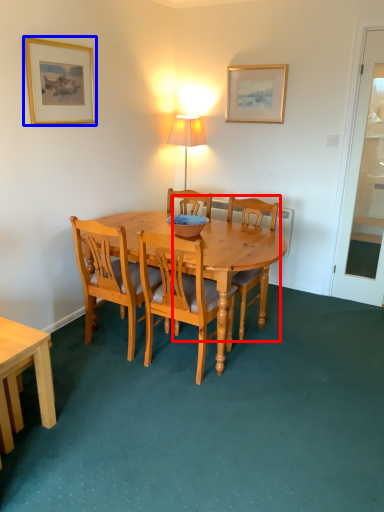
Question: Which object appears farthest to the camera in this image, chair (highlighted by a red box) or picture frame (highlighted by a blue box)?

Choices:
 (A) chair
 (B) picture frame

Answer: (A)